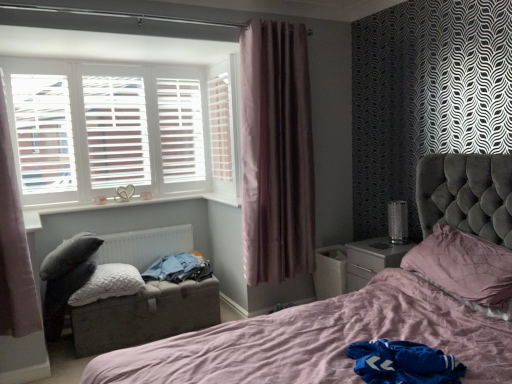
Question: From the image's perspective, is white wooden shutters at upper left above or below pink satin pillow at right, which is the second pillow in back-to-front order?

Choices:
 (A) below
 (B) above

Answer: (B)

Question: In the image, is white wooden shutters at upper left positioned in front of or behind pink satin pillow at right, arranged as the second pillow when viewed from the left?

Choices:
 (A) front
 (B) behind

Answer: (B)

Question: Based on their relative distances, which object is farther from the black mesh table lamp at right?

Choices:
 (A) white textured pillow at lower left, marked as the second pillow in a right-to-left arrangement
 (B) white metallic radiator at lower left
 (C) matte gray cushioned footrest at lower left
 (D) pink satin pillow at right, marked as the 1th pillow in a right-to-left arrangement
 (E) purple velvet curtain at center, which is counted as the 1th curtain, starting from the right

Answer: (A)

Question: Estimate the real-world distances between objects in this image. Which object is farther from the pink satin pillow at right, which is the second pillow in back-to-front order?

Choices:
 (A) white glossy window sill at lower left
 (B) black mesh table lamp at right
 (C) white wooden shutters at upper left
 (D) white metallic radiator at lower left
 (E) pink fabric curtain at left, placed as the 1th curtain when sorted from front to back

Answer: (E)